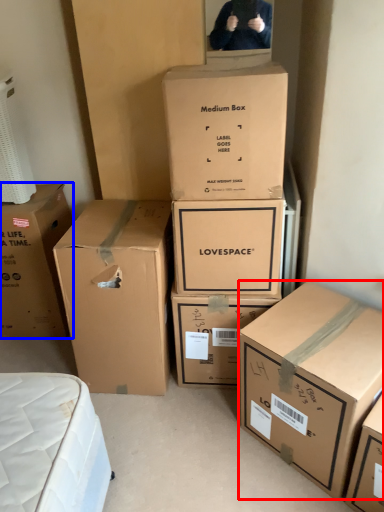
Question: Which of the following is the farthest to the observer, box (highlighted by a red box) or box (highlighted by a blue box)?

Choices:
 (A) box
 (B) box

Answer: (B)